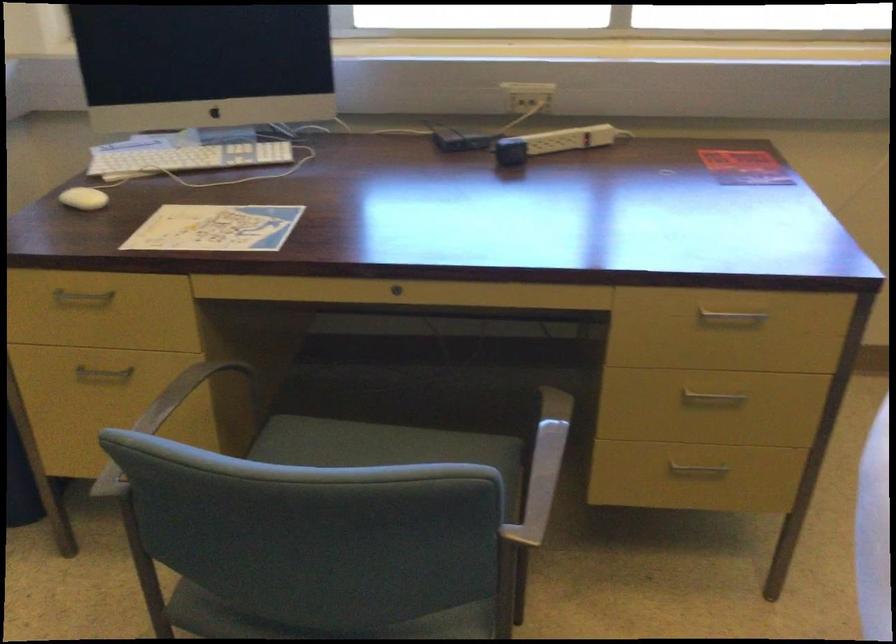
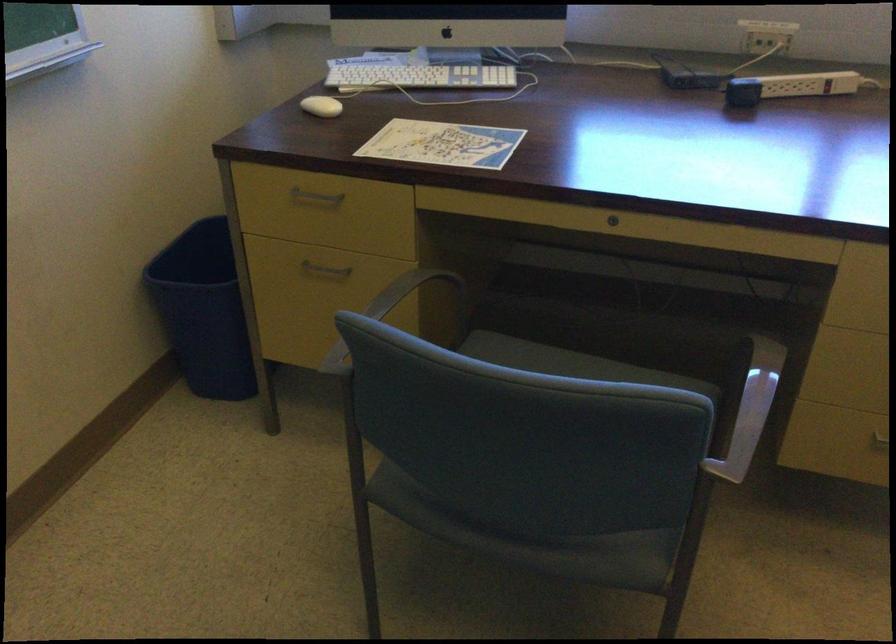
Where in the second image is the point corresponding to (84,200) from the first image?

(321, 106)